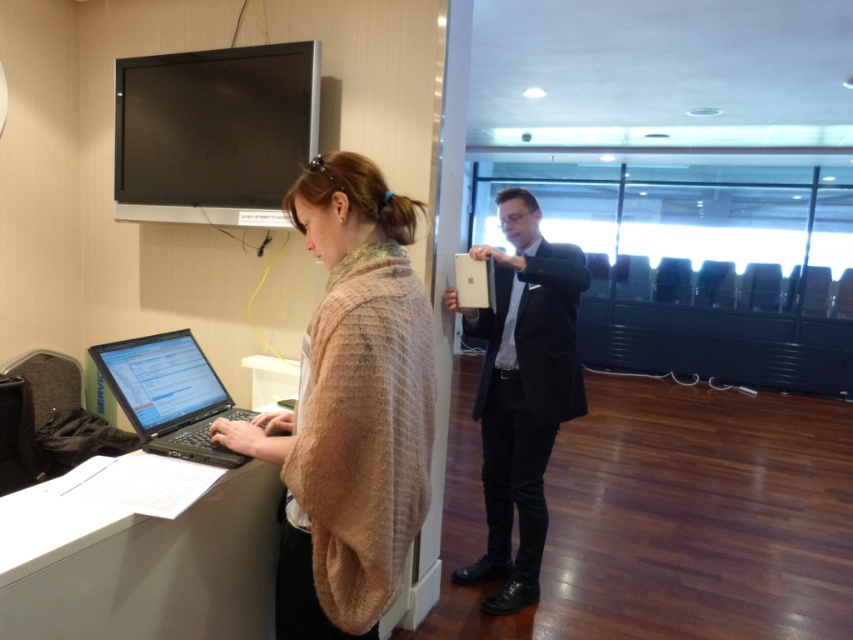
You are standing in the conference room and need to determine which of the two points, point 1 at coordinates point (334, 436) or point 2 at coordinates point (109, 372), is closer to you. Which point is closer?

Point 1 at coordinates point (334, 436) is closer to you than point 2 at coordinates point (109, 372).

In the scene shown: Where is the beige knitted shawl at center located in the image?

The beige knitted shawl at center is located at the coordinates point (350, 408).

You are organizing a meeting in this room and need to place a 15cm wide notebook between the beige knitted shawl at center and the black matte laptop at left. Can you fit it there?

The beige knitted shawl at center is in front of the black matte laptop at left, so there is space between them to place the notebook.